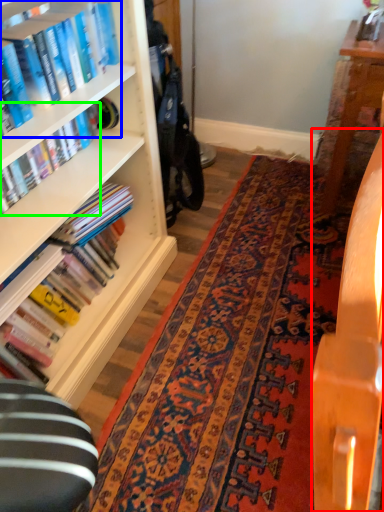
Question: Based on their relative distances, which object is farther from table (highlighted by a red box)? Choose from book (highlighted by a blue box) and book (highlighted by a green box).

Choices:
 (A) book
 (B) book

Answer: (B)